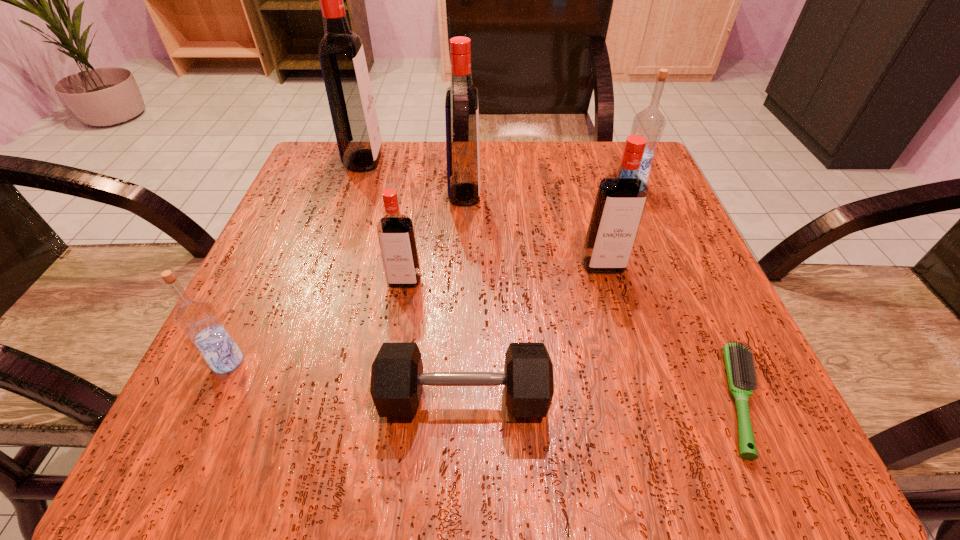
Locate an element on the screen. The height and width of the screenshot is (540, 960). free region located on the right of the smaller blue vodka is located at coordinates (285, 361).

Identify the location of vacant space situated 0.230m on the left of the dumbbell. (210, 397).

Locate an element on the screen. vacant space situated on the back of the light hairbrush is located at coordinates (661, 224).

Locate an element on the screen. dumbbell located at the near edge is located at coordinates (397, 378).

Find the location of a particular element. This screenshot has height=540, width=960. hairbrush at the near edge is located at coordinates (739, 361).

The width and height of the screenshot is (960, 540). I want to click on hairbrush located at the right edge, so click(x=739, y=361).

Identify the location of object at the far left corner. This screenshot has width=960, height=540. (341, 54).

Find the location of a particular element. This screenshot has height=540, width=960. object at the far right corner is located at coordinates (650, 123).

Identify the location of object positioned at the near right corner. (739, 361).

Identify the location of vacant space at the near edge of the desktop. (382, 428).